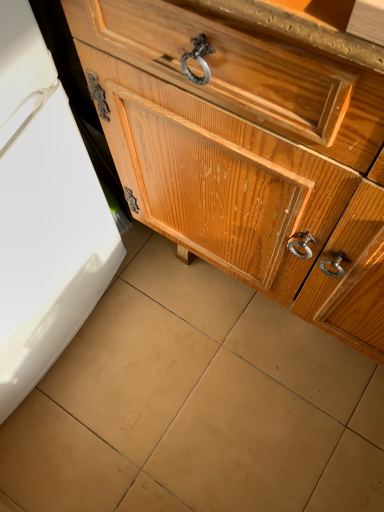
Question: Is brown matte tile at center further to the viewer compared to glossy wood chest of drawers at center?

Choices:
 (A) no
 (B) yes

Answer: (B)

Question: From a real-world perspective, is brown matte tile at center located beneath glossy wood chest of drawers at center?

Choices:
 (A) no
 (B) yes

Answer: (B)

Question: Is brown matte tile at center positioned beyond the bounds of glossy wood chest of drawers at center?

Choices:
 (A) no
 (B) yes

Answer: (B)

Question: Is brown matte tile at center bigger than glossy wood chest of drawers at center?

Choices:
 (A) no
 (B) yes

Answer: (A)

Question: Is brown matte tile at center at the left side of glossy wood chest of drawers at center?

Choices:
 (A) no
 (B) yes

Answer: (B)

Question: Would you consider brown matte tile at center to be distant from glossy wood chest of drawers at center?

Choices:
 (A) yes
 (B) no

Answer: (B)

Question: Considering the relative sizes of glossy wood chest of drawers at center and brown matte tile at center in the image provided, is glossy wood chest of drawers at center smaller than brown matte tile at center?

Choices:
 (A) yes
 (B) no

Answer: (B)

Question: Does glossy wood chest of drawers at center have a greater height compared to brown matte tile at center?

Choices:
 (A) no
 (B) yes

Answer: (B)

Question: Is glossy wood chest of drawers at center not close to brown matte tile at center?

Choices:
 (A) yes
 (B) no

Answer: (B)

Question: Is brown matte tile at center at the back of glossy wood chest of drawers at center?

Choices:
 (A) yes
 (B) no

Answer: (B)

Question: Is glossy wood chest of drawers at center directly adjacent to brown matte tile at center?

Choices:
 (A) no
 (B) yes

Answer: (A)

Question: Does glossy wood chest of drawers at center appear on the left side of brown matte tile at center?

Choices:
 (A) yes
 (B) no

Answer: (B)

Question: Considering the positions of point (244, 454) and point (370, 269), is point (244, 454) closer or farther from the camera than point (370, 269)?

Choices:
 (A) farther
 (B) closer

Answer: (A)